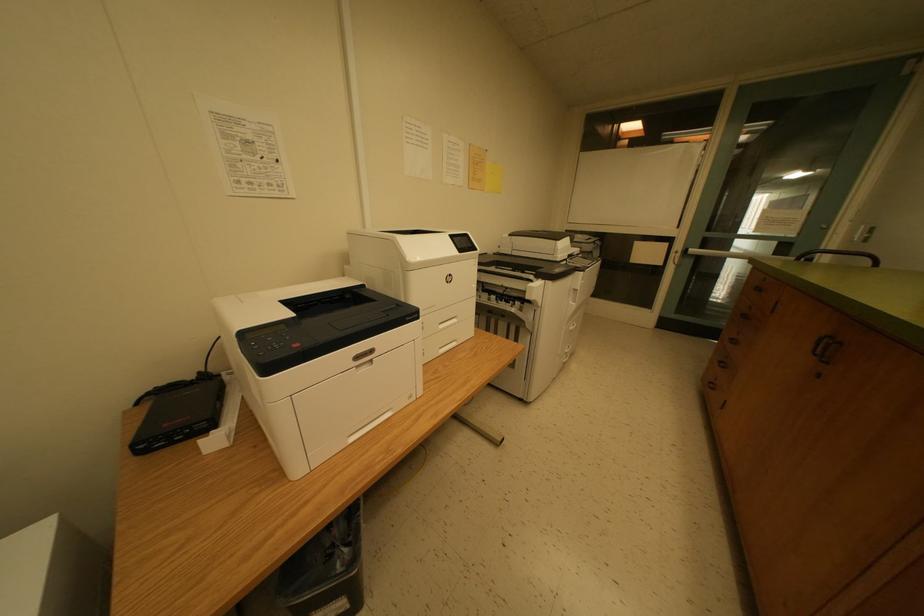
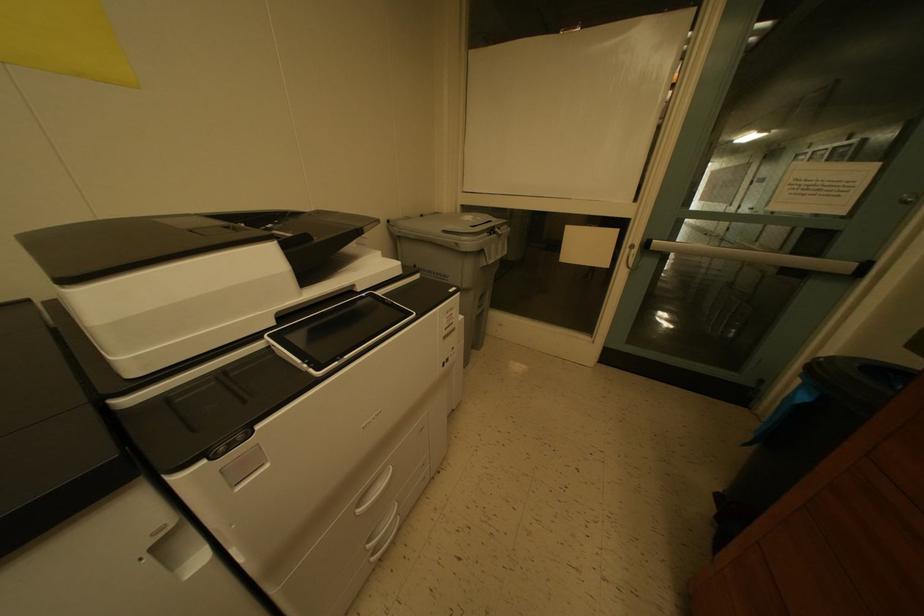
Which direction would the cameraman need to move to produce the second image?

The cameraman walked toward right, forward.